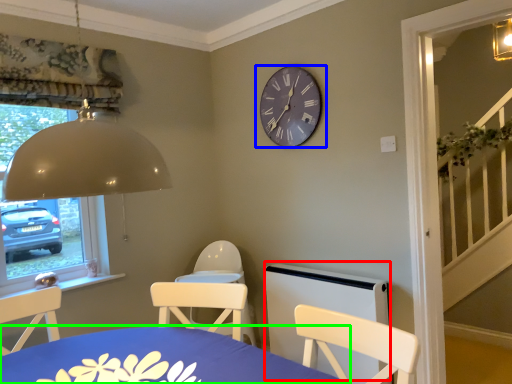
Question: Which is farther away from bed frame (highlighted by a red box)? wall clock (highlighted by a blue box) or table (highlighted by a green box)?

Choices:
 (A) wall clock
 (B) table

Answer: (B)